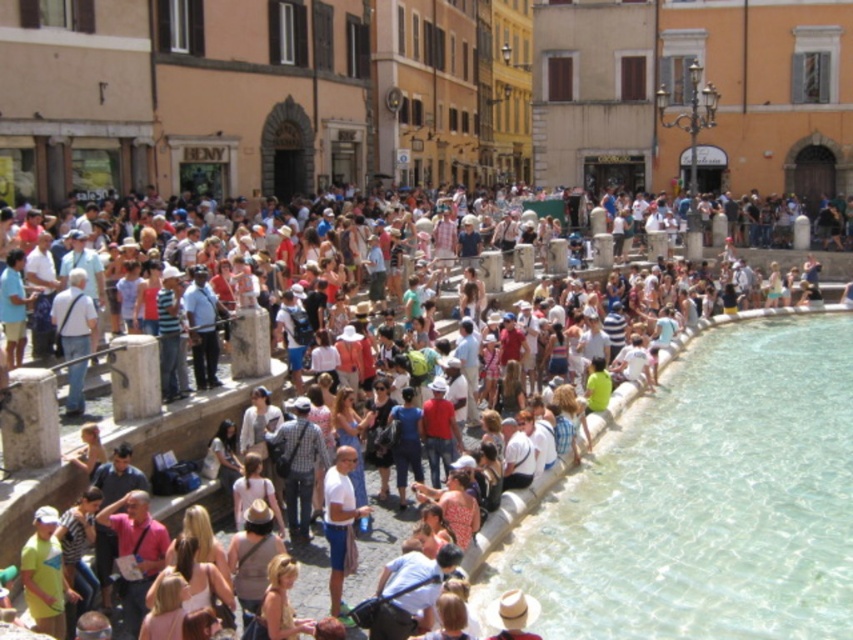
Which of these two, clear stone pool at lower right or matte stone crowd at center, stands taller?

Standing taller between the two is matte stone crowd at center.

Is point (805, 550) farther from viewer compared to point (173, 493)?

Yes.

Is point (572, 525) farther from camera compared to point (268, 365)?

No, it is in front of (268, 365).

This screenshot has height=640, width=853. In order to click on clear stone pool at lower right in this screenshot , I will do `click(708, 499)`.